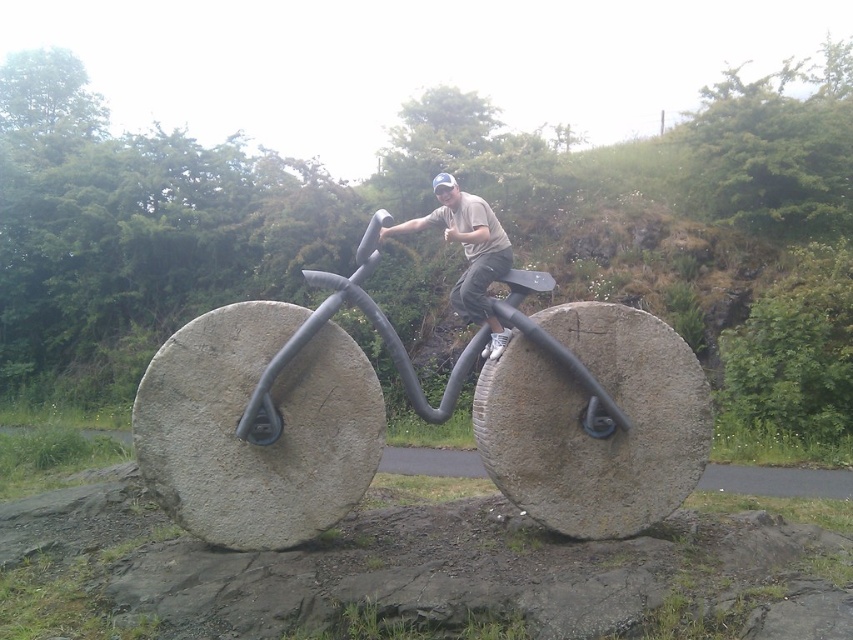
Question: Which point appears farthest from the camera in this image?

Choices:
 (A) (489, 205)
 (B) (494, 388)

Answer: (A)

Question: Is gray stone bicycle at center to the left of matte gray bicycle at center from the viewer's perspective?

Choices:
 (A) no
 (B) yes

Answer: (B)

Question: Which point is farther to the camera?

Choices:
 (A) (438, 211)
 (B) (320, 275)

Answer: (A)

Question: Is gray stone bicycle at center further to camera compared to matte gray bicycle at center?

Choices:
 (A) no
 (B) yes

Answer: (A)

Question: Where is gray stone bicycle at center located in relation to matte gray bicycle at center in the image?

Choices:
 (A) above
 (B) below

Answer: (B)